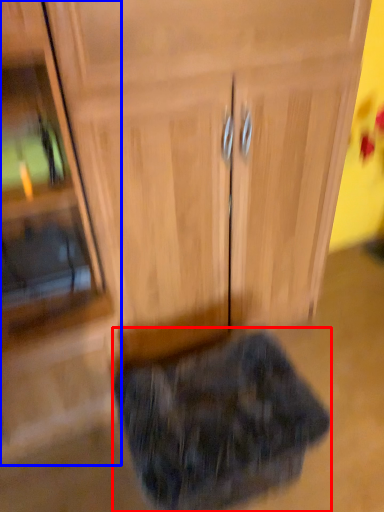
Question: Among these objects, which one is farthest to the camera, animal (highlighted by a red box) or side cabinet (highlighted by a blue box)?

Choices:
 (A) animal
 (B) side cabinet

Answer: (A)